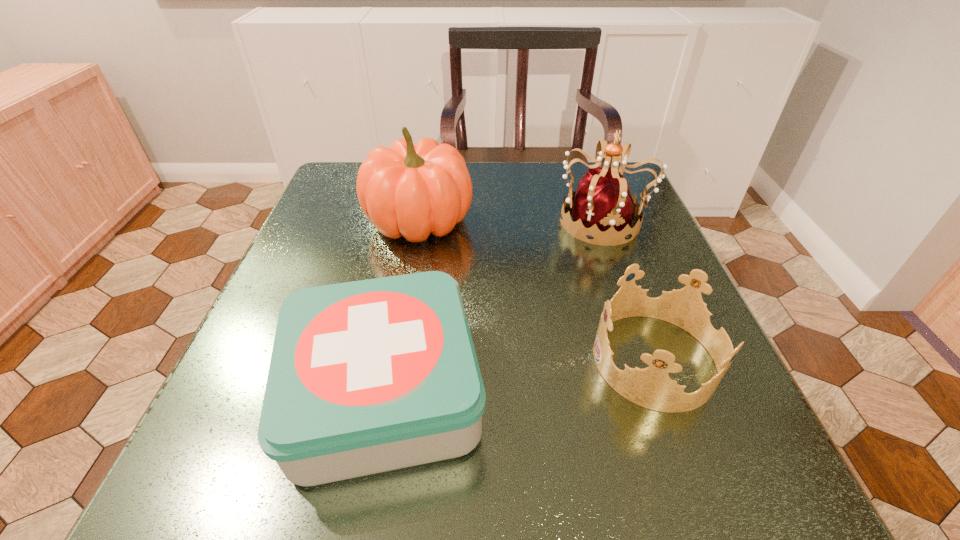
I want to click on vacant region at the far edge of the desktop, so click(515, 166).

Find the location of `vacant space at the near edge`. vacant space at the near edge is located at coordinates (352, 486).

This screenshot has width=960, height=540. I want to click on free spot at the left edge of the desktop, so click(292, 252).

You are a GUI agent. You are given a task and a screenshot of the screen. Output one action in this format:
    pyautogui.click(x=<x>, y=<y>)
    Task: Click on the free location at the right edge
    Image resolution: width=960 pixels, height=540 pixels.
    Given the screenshot: What is the action you would take?
    pyautogui.click(x=643, y=238)

Locate an element on the screen. vacant space at the far left corner is located at coordinates (325, 201).

Locate an element on the screen. This screenshot has height=540, width=960. free space at the near left corner is located at coordinates (265, 471).

Where is `vacant area between the first-aid kit and the shorter tiara`? vacant area between the first-aid kit and the shorter tiara is located at coordinates click(519, 376).

Where is `vacant area between the pumpkin and the farther tiara`? vacant area between the pumpkin and the farther tiara is located at coordinates (512, 221).

Image resolution: width=960 pixels, height=540 pixels. Find the location of `free space between the first-aid kit and the shorter tiara`. free space between the first-aid kit and the shorter tiara is located at coordinates (519, 376).

This screenshot has width=960, height=540. I want to click on vacant area between the nearer tiara and the pumpkin, so tap(537, 290).